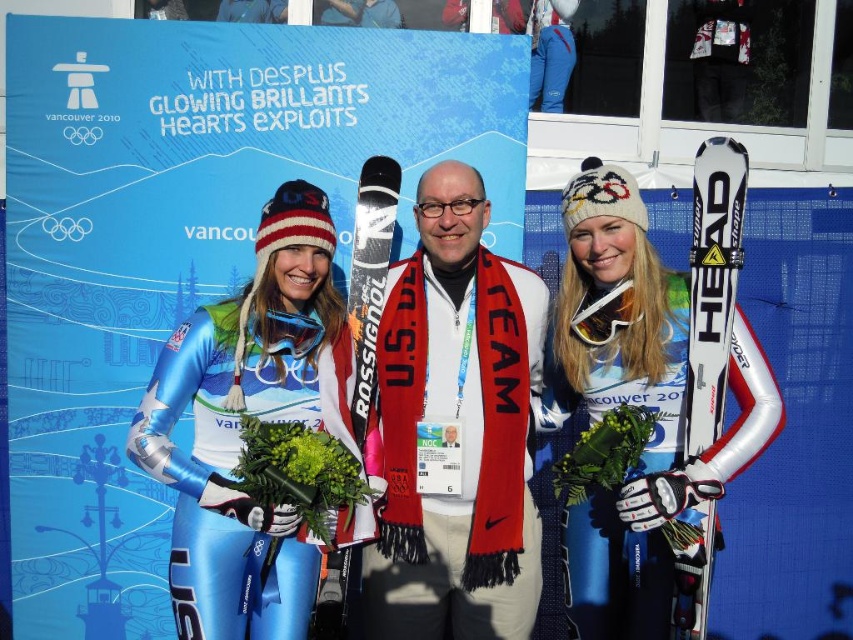
Question: Is white matte scarf at center closer to the viewer compared to white matte ski at right?

Choices:
 (A) no
 (B) yes

Answer: (A)

Question: Which of the following is the closest to the observer?

Choices:
 (A) blue metallic ski suit at left
 (B) black matte ski at center

Answer: (A)

Question: Can you confirm if white matte scarf at center is wider than blue metallic ski suit at left?

Choices:
 (A) yes
 (B) no

Answer: (B)

Question: Considering the real-world distances, which object is closest to the blue metallic ski suit at left?

Choices:
 (A) white matte ski at right
 (B) black matte ski at center

Answer: (B)

Question: Among these objects, which one is nearest to the camera?

Choices:
 (A) black matte ski at center
 (B) metallic blue ski suit at center
 (C) white matte ski at center
 (D) white matte scarf at center

Answer: (B)

Question: Is white matte scarf at center smaller than black matte ski at center?

Choices:
 (A) no
 (B) yes

Answer: (A)